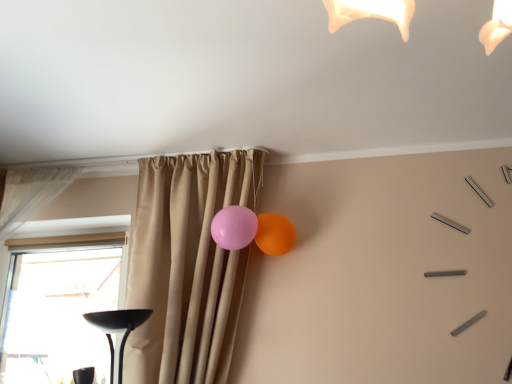
Question: Is pink rubber balloon at center, the first balloon when ordered from left to right, closer to the viewer compared to white sheer curtain at left, arranged as the 2th curtain when viewed from the right?

Choices:
 (A) no
 (B) yes

Answer: (B)

Question: Considering the relative sizes of pink rubber balloon at center, the 2th balloon positioned from the right, and white sheer curtain at left, which is the first curtain in left-to-right order, in the image provided, is pink rubber balloon at center, the 2th balloon positioned from the right, bigger than white sheer curtain at left, which is the first curtain in left-to-right order,?

Choices:
 (A) no
 (B) yes

Answer: (A)

Question: Is the position of pink rubber balloon at center, the first balloon when ordered from left to right, more distant than that of white sheer curtain at left, which is the first curtain in left-to-right order?

Choices:
 (A) yes
 (B) no

Answer: (B)

Question: Is pink rubber balloon at center, the first balloon when ordered from left to right, taller than white sheer curtain at left, arranged as the 2th curtain when viewed from the right?

Choices:
 (A) yes
 (B) no

Answer: (B)

Question: Is pink rubber balloon at center, the 2th balloon positioned from the right, not close to white sheer curtain at left, which is the first curtain in left-to-right order?

Choices:
 (A) no
 (B) yes

Answer: (B)

Question: Visually, is beige curtain at center, which is the 1th curtain in right-to-left order, positioned to the left or to the right of pink rubber balloon at center, the first balloon when ordered from left to right?

Choices:
 (A) left
 (B) right

Answer: (A)

Question: From a real-world perspective, is beige curtain at center, the second curtain in the left-to-right sequence, physically located above or below pink rubber balloon at center, the 2th balloon positioned from the right?

Choices:
 (A) above
 (B) below

Answer: (B)

Question: Is beige curtain at center, which is the 1th curtain in right-to-left order, wider or thinner than pink rubber balloon at center, the first balloon when ordered from left to right?

Choices:
 (A) wide
 (B) thin

Answer: (A)

Question: In terms of height, does beige curtain at center, which is the 1th curtain in right-to-left order, look taller or shorter compared to pink rubber balloon at center, the 2th balloon positioned from the right?

Choices:
 (A) tall
 (B) short

Answer: (A)

Question: Considering the positions of beige curtain at center, which is the 1th curtain in right-to-left order, and matte rubber balloon at upper right, positioned as the 1th balloon in right-to-left order, in the image, is beige curtain at center, which is the 1th curtain in right-to-left order, wider or thinner than matte rubber balloon at upper right, positioned as the 1th balloon in right-to-left order,?

Choices:
 (A) wide
 (B) thin

Answer: (A)

Question: Is beige curtain at center, which is the 1th curtain in right-to-left order, bigger or smaller than matte rubber balloon at upper right, which appears as the 2th balloon when viewed from the left?

Choices:
 (A) big
 (B) small

Answer: (A)

Question: Choose the correct answer: Is beige curtain at center, the second curtain in the left-to-right sequence, inside matte rubber balloon at upper right, positioned as the 1th balloon in right-to-left order, or outside it?

Choices:
 (A) outside
 (B) inside

Answer: (A)

Question: Would you say beige curtain at center, which is the 1th curtain in right-to-left order, is to the left or to the right of matte rubber balloon at upper right, positioned as the 1th balloon in right-to-left order, in the picture?

Choices:
 (A) right
 (B) left

Answer: (B)

Question: Considering the positions of transparent glass window at lower left and matte rubber balloon at upper right, positioned as the 1th balloon in right-to-left order, in the image, is transparent glass window at lower left wider or thinner than matte rubber balloon at upper right, positioned as the 1th balloon in right-to-left order,?

Choices:
 (A) thin
 (B) wide

Answer: (A)

Question: Is transparent glass window at lower left bigger or smaller than matte rubber balloon at upper right, positioned as the 1th balloon in right-to-left order?

Choices:
 (A) big
 (B) small

Answer: (A)